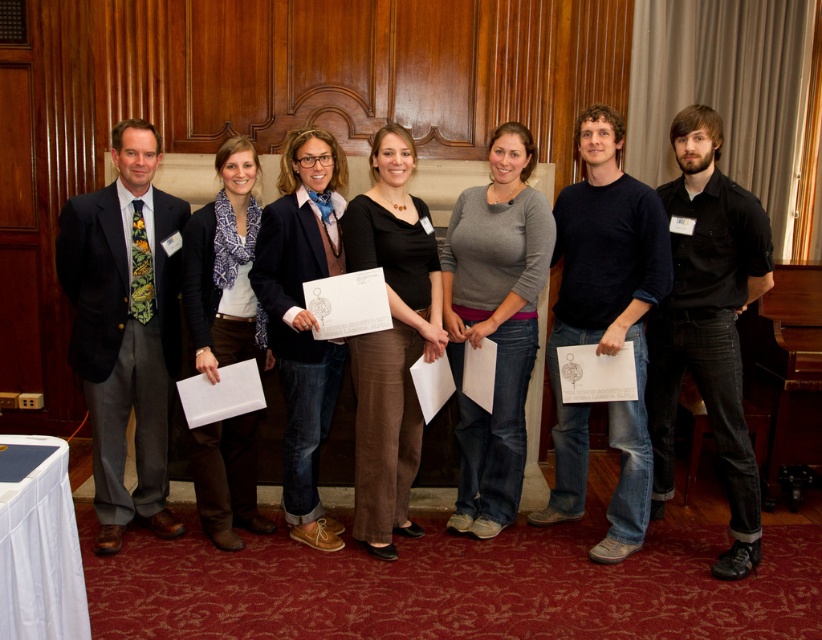
How far apart are dark gray suit at left and black cotton shirt at center?

A distance of 1.97 meters exists between dark gray suit at left and black cotton shirt at center.

Is point (155, 243) less distant than point (557, 448)?

That is True.

At what (x,y) coordinates should I click in order to perform the action: click on dark gray suit at left. Please return your answer as a coordinate pair (x, y). The width and height of the screenshot is (822, 640). Looking at the image, I should click on (123, 326).

Does black cotton shirt at center come in front of gray matte sweater at center?

That is True.

Describe the element at coordinates (605, 324) in the screenshot. This screenshot has width=822, height=640. I see `black cotton shirt at center` at that location.

Describe the element at coordinates (605, 324) in the screenshot. This screenshot has width=822, height=640. I see `black cotton shirt at center` at that location.

Locate an element on the screen. This screenshot has height=640, width=822. black cotton shirt at center is located at coordinates (605, 324).

In the scene shown: Between gray matte sweater at center and matte black jacket at center, which one has less height?

matte black jacket at center is shorter.

Who is more forward, (470, 531) or (289, 310)?

Positioned in front is point (289, 310).

Find the location of a particular element. The image size is (822, 640). gray matte sweater at center is located at coordinates (495, 323).